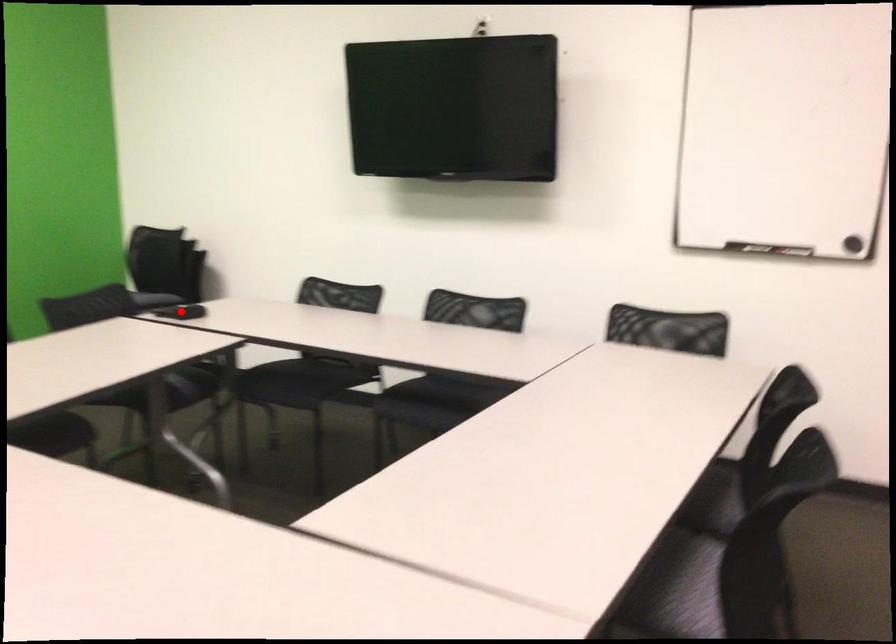
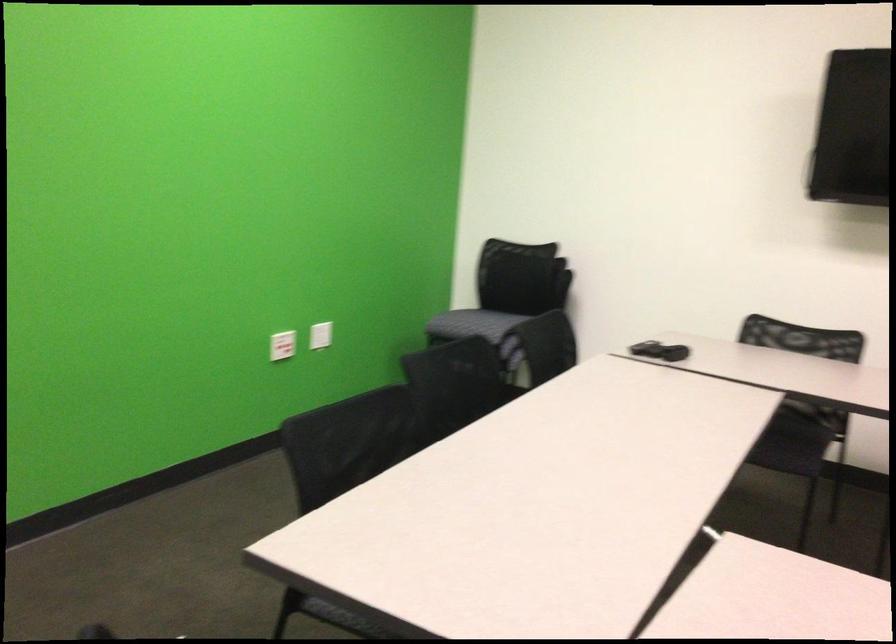
Question: I am providing you with two images of the same scene from different viewpoints. A red point is marked on the first image. Can you still see the location of the red point in image 2?

Choices:
 (A) Yes
 (B) No

Answer: (B)